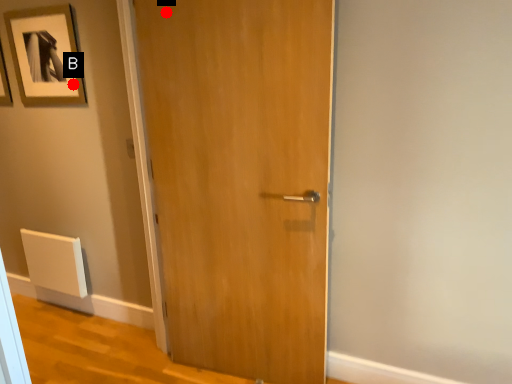
Question: Two points are circled on the image, labeled by A and B beside each circle. Which point appears farthest from the camera in this image?

Choices:
 (A) A is further
 (B) B is further

Answer: (B)